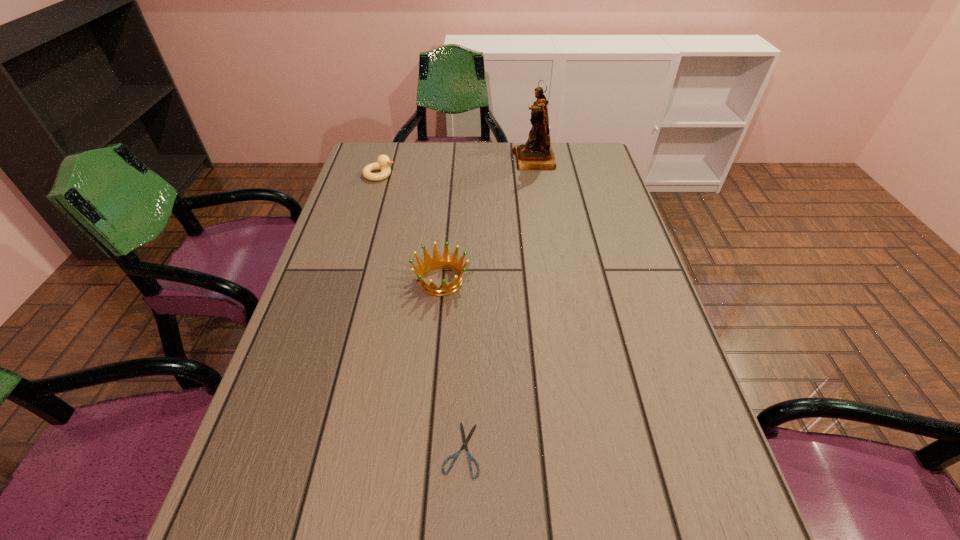
You are a GUI agent. You are given a task and a screenshot of the screen. Output one action in this format:
    pyautogui.click(x=<x>, y=<y>)
    Task: Click on the rightmost object
    
    Given the screenshot: What is the action you would take?
    click(x=536, y=154)

Find the location of a particular element. Image resolution: width=960 pixels, height=540 pixels. the tallest object is located at coordinates (536, 154).

Find the location of a particular element. The image size is (960, 540). duckling is located at coordinates (383, 161).

This screenshot has height=540, width=960. Find the location of `crown`. crown is located at coordinates (454, 265).

Where is `the shortest object`? the shortest object is located at coordinates (465, 440).

This screenshot has width=960, height=540. Identify the location of the nearest object. (465, 440).

At what (x,y) coordinates should I click in order to perform the action: click on vacant space located on the front-facing side of the tallest object. Please return your answer as a coordinate pair (x, y). The width and height of the screenshot is (960, 540). Looking at the image, I should click on (418, 160).

Where is `free space located 0.100m on the front-facing side of the tallest object`? free space located 0.100m on the front-facing side of the tallest object is located at coordinates pos(484,160).

You are a GUI agent. You are given a task and a screenshot of the screen. Output one action in this format:
    pyautogui.click(x=<x>, y=<y>)
    Task: Click on the free space located on the front-facing side of the tallest object
    
    Given the screenshot: What is the action you would take?
    pyautogui.click(x=487, y=160)

Find the location of `vacant space located at the beak of the duckling`. vacant space located at the beak of the duckling is located at coordinates (465, 175).